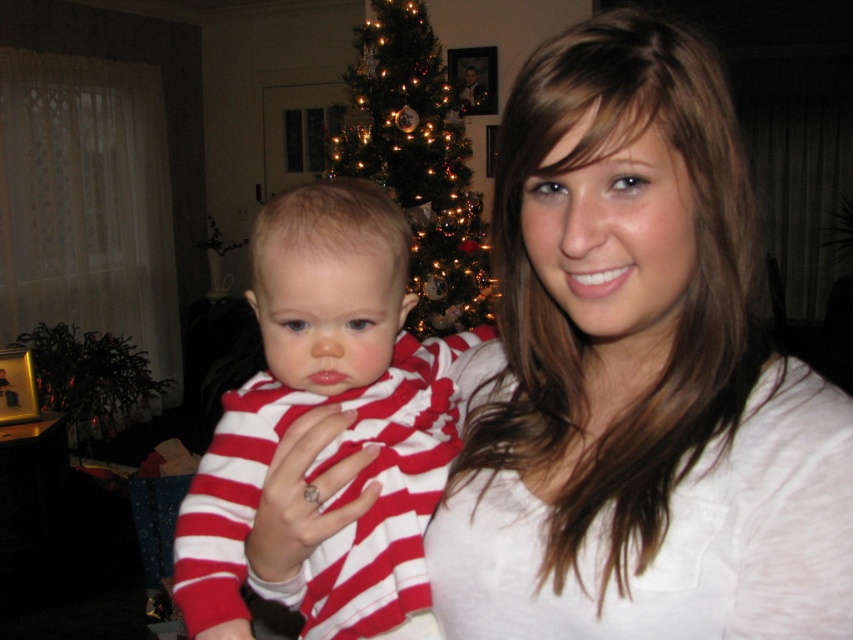
Question: Among these points, which one is nearest to the camera?

Choices:
 (A) (412, 90)
 (B) (372, 513)
 (C) (743, 225)

Answer: (C)

Question: Considering the relative positions of red striped shirt at center and iridescent glass ornaments at center in the image provided, where is red striped shirt at center located with respect to iridescent glass ornaments at center?

Choices:
 (A) below
 (B) above

Answer: (A)

Question: Which object is farther from the camera taking this photo?

Choices:
 (A) white matte shirt at center
 (B) red striped shirt at center

Answer: (B)

Question: In this image, where is red striped shirt at center located relative to iridescent glass ornaments at center?

Choices:
 (A) below
 (B) above

Answer: (A)

Question: Is red striped shirt at center to the left of iridescent glass ornaments at center from the viewer's perspective?

Choices:
 (A) no
 (B) yes

Answer: (A)

Question: Which of these objects is positioned closest to the white matte shirt at center?

Choices:
 (A) iridescent glass ornaments at center
 (B) red striped shirt at center

Answer: (B)